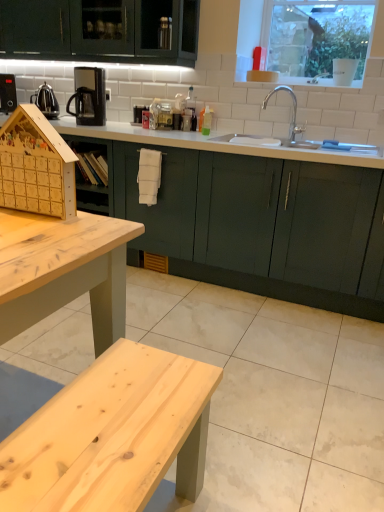
Question: Considering their positions, is clear glass window at upper center located in front of or behind wooden advent calendar at left?

Choices:
 (A) front
 (B) behind

Answer: (B)

Question: Considering the positions of clear glass window at upper center and wooden advent calendar at left in the image, is clear glass window at upper center taller or shorter than wooden advent calendar at left?

Choices:
 (A) short
 (B) tall

Answer: (B)

Question: Estimate the real-world distances between objects in this image. Which object is closer to the polished stainless steel kettle at left?

Choices:
 (A) wooden advent calendar at left
 (B) clear glass window at upper center
 (C) white glossy countertop at center
 (D) black plastic coffee machine at upper left

Answer: (D)

Question: Which object is the closest to the black plastic coffee machine at upper left?

Choices:
 (A) polished stainless steel kettle at left
 (B) wooden advent calendar at left
 (C) clear glass window at upper center
 (D) white glossy countertop at center

Answer: (A)